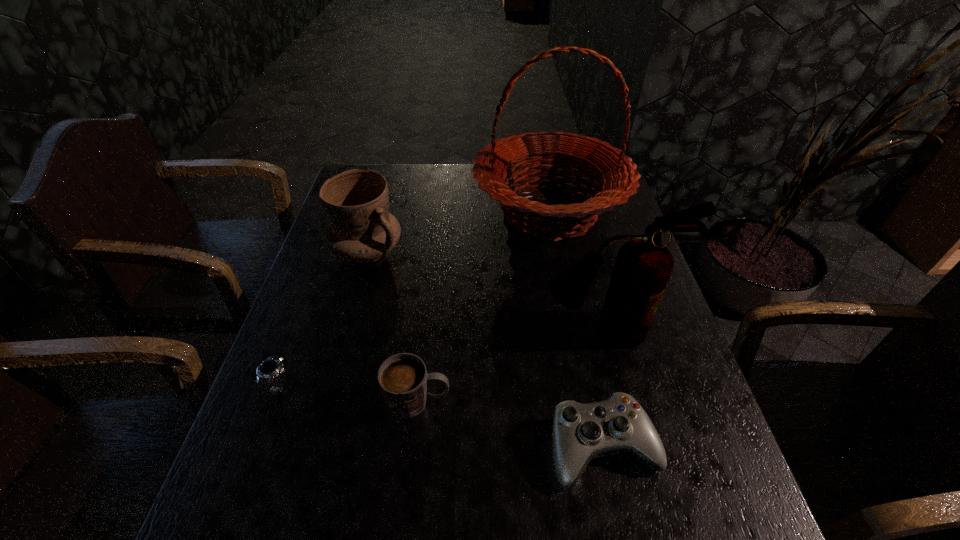
This screenshot has width=960, height=540. I want to click on vacant space located on the front of the fourth shortest object, so click(x=351, y=308).

Locate an element on the screen. vacant position located on the side of the mug with the handle is located at coordinates (628, 401).

In order to click on vacant region located 0.190m on the left of the second shortest object in this screenshot , I will do `click(450, 447)`.

Find the location of `vacant area situated on the right of the watch`. vacant area situated on the right of the watch is located at coordinates (451, 386).

This screenshot has width=960, height=540. In order to click on object that is at the far edge in this screenshot , I will do `click(616, 174)`.

I want to click on pottery that is at the left edge, so click(x=356, y=202).

The width and height of the screenshot is (960, 540). I want to click on watch that is at the left edge, so click(x=275, y=366).

Where is `basket that is positioned at the right edge`? Image resolution: width=960 pixels, height=540 pixels. basket that is positioned at the right edge is located at coordinates (616, 174).

What are the coordinates of `fire extinguisher that is at the right edge` in the screenshot? It's located at (643, 266).

Find the location of a particular element. Image resolution: width=960 pixels, height=540 pixels. control at the right edge is located at coordinates (581, 432).